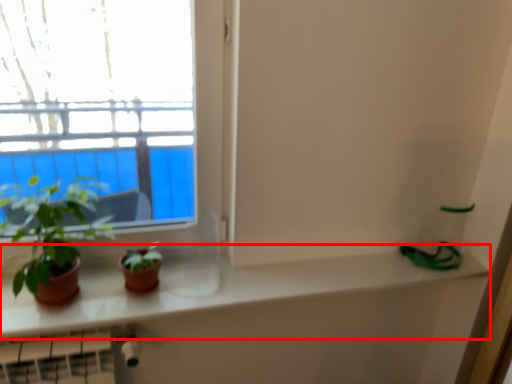
Question: From the image's perspective, where is counter top (annotated by the red box) located relative to houseplant?

Choices:
 (A) below
 (B) above

Answer: (A)